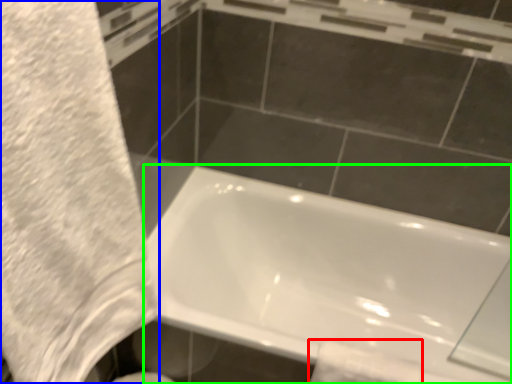
Question: Based on their relative distances, which object is nearer to toilet paper (highlighted by a red box)? Choose from bath towel (highlighted by a blue box) and bathtub (highlighted by a green box).

Choices:
 (A) bath towel
 (B) bathtub

Answer: (B)